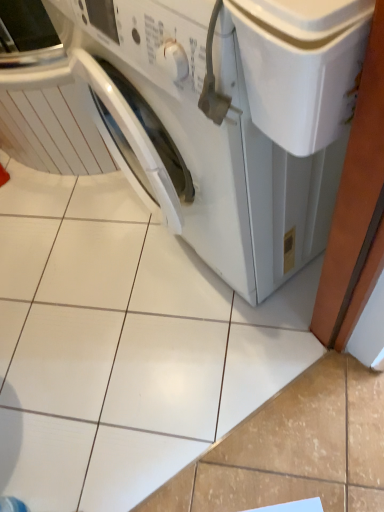
Question: Should I look upward or downward to see white glossy washing machine at center?

Choices:
 (A) up
 (B) down

Answer: (A)